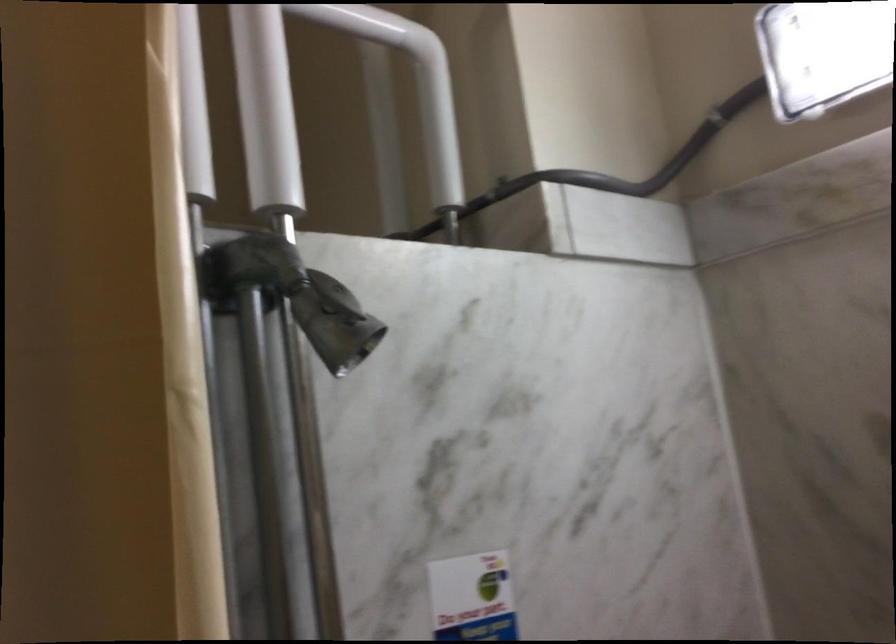
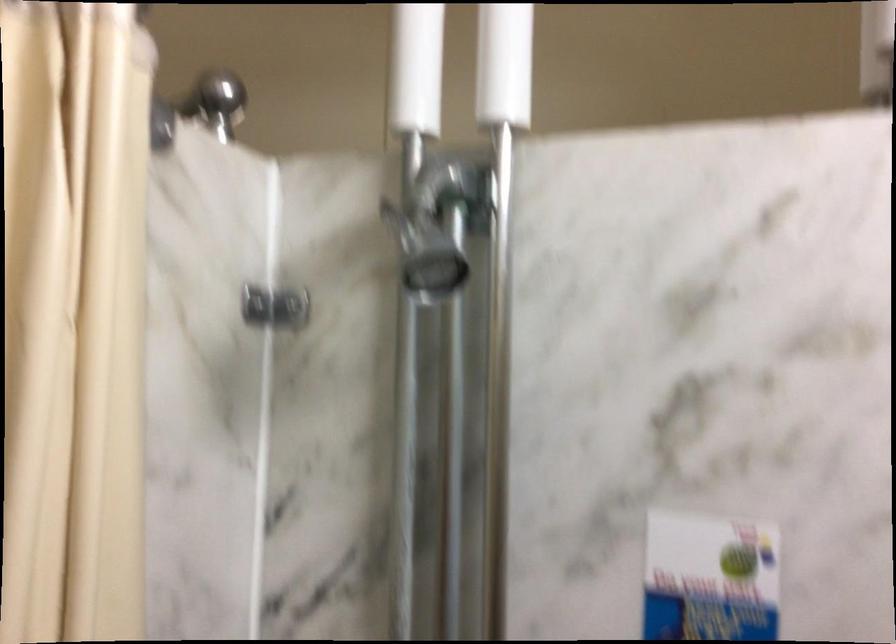
Question: The images are taken continuously from a first-person perspective. In which direction are you moving?

Choices:
 (A) Left
 (B) Right
 (C) Forward
 (D) Backward

Answer: (D)